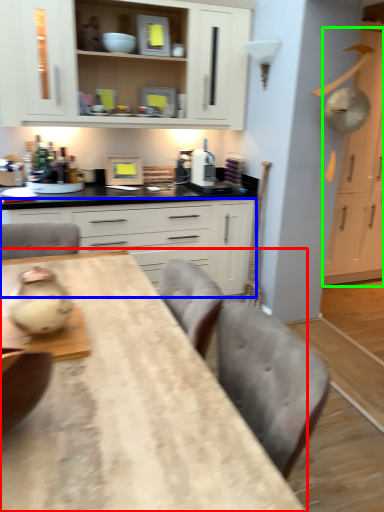
Question: Considering the real-world distances, which object is closest to table (highlighted by a red box)? cabinetry (highlighted by a blue box) or cabinetry (highlighted by a green box).

Choices:
 (A) cabinetry
 (B) cabinetry

Answer: (A)